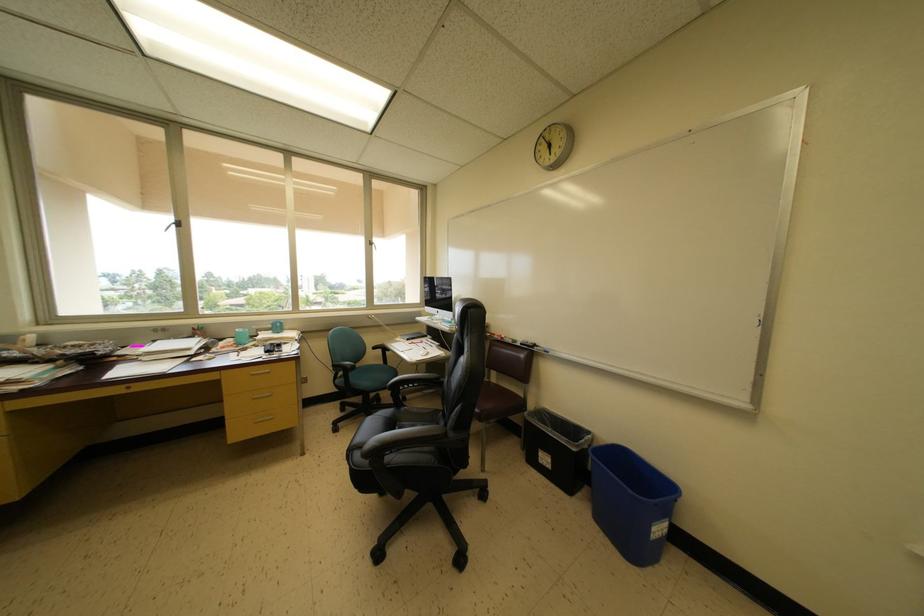
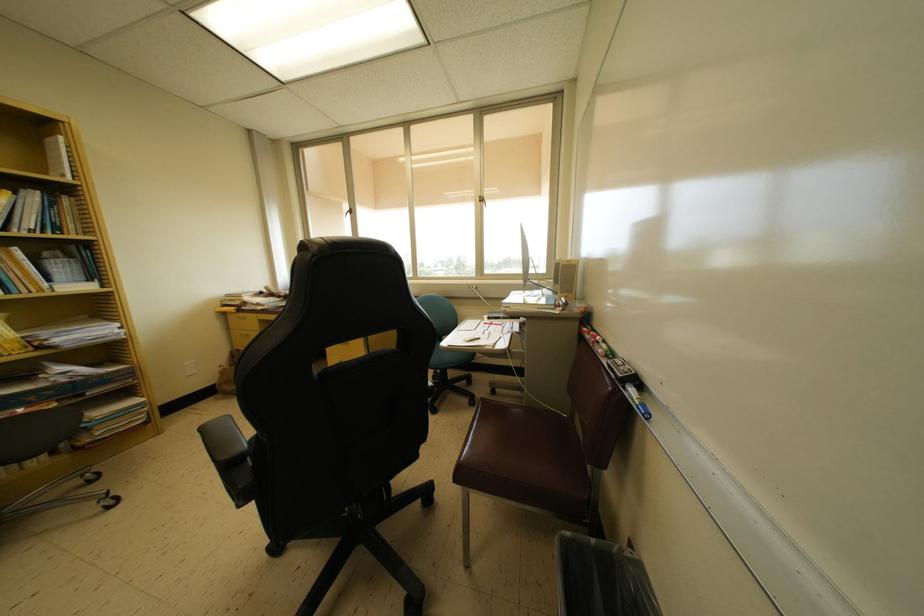
Question: I am providing you with two images of the same scene from different viewpoints. Which of the following objects are not visible in image2?

Choices:
 (A) black board eraser
 (B) teal mug
 (C) blue chair sitting surface
 (D) white basket lid handle

Answer: (B)